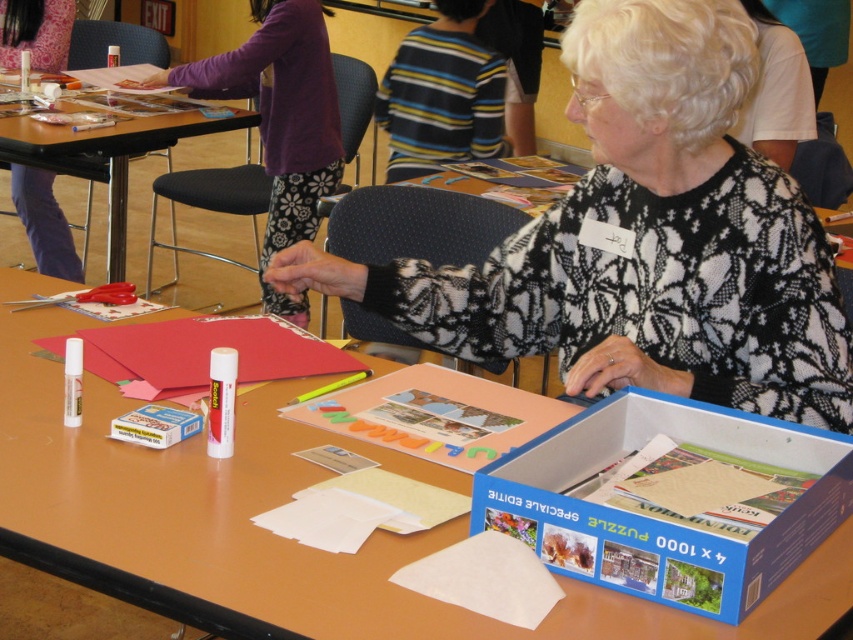
You are an observer looking at the image. Can you tell me the position of the white lace sweater at center relative to the purple fabric pants at upper left?

The white lace sweater at center is positioned to the right of the purple fabric pants at upper left.

You are a photographer taking a picture of the striped sweater at center and the matte black scissors at left. Which object should you focus on first if you want to ensure both are in focus, given that the depth of field can only cover objects within a 5 cm height difference?

The striped sweater at center is taller than the matte black scissors at left. To ensure both are in focus, focus on the striped sweater at center since it is the taller object, and the height difference between them is within the 5 cm depth of field.